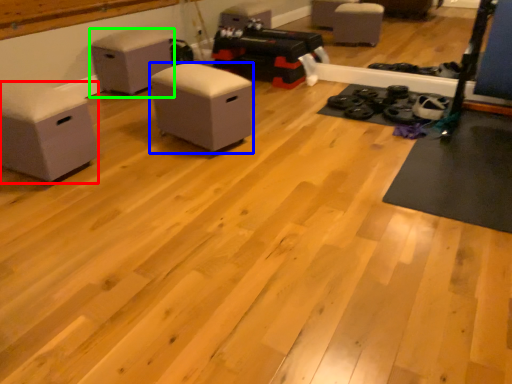
Question: Which object is positioned closest to furniture (highlighted by a red box)? Select from furniture (highlighted by a blue box) and furniture (highlighted by a green box).

Choices:
 (A) furniture
 (B) furniture

Answer: (A)